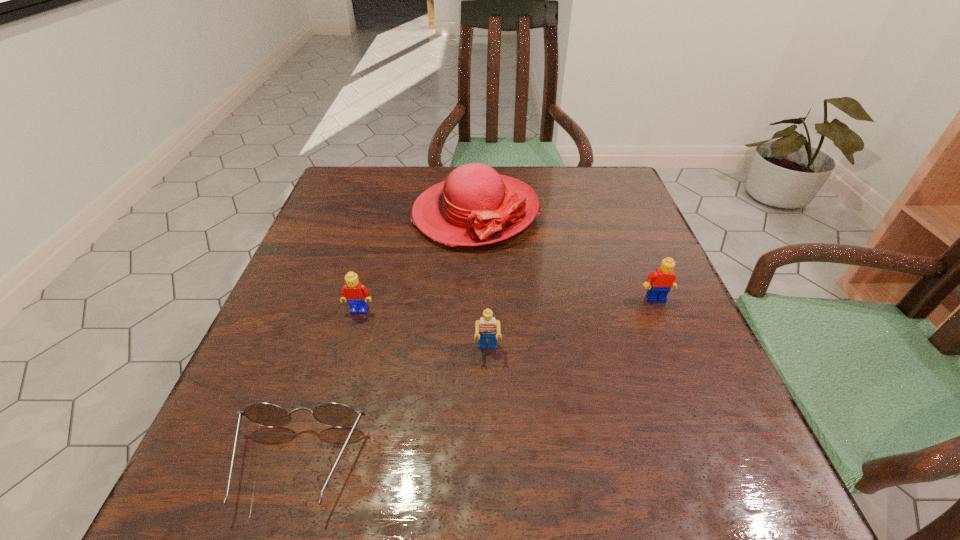
This screenshot has height=540, width=960. What are the coordinates of `free space located at the front of the tallest object with a bow` in the screenshot? It's located at (473, 349).

Where is `vacant space located 0.280m on the face of the rightmost Lego`? vacant space located 0.280m on the face of the rightmost Lego is located at coordinates (716, 443).

What are the coordinates of `free spot located on the front-facing side of the leftmost Lego` in the screenshot? It's located at coord(308,495).

Where is `vacant space situated on the face of the second Lego from left to right`? This screenshot has width=960, height=540. vacant space situated on the face of the second Lego from left to right is located at coordinates (489, 427).

Where is `object located in the far edge section of the desktop`? object located in the far edge section of the desktop is located at coordinates (474, 206).

Find the location of a particular element. The width and height of the screenshot is (960, 540). object present at the near edge is located at coordinates (333, 414).

Identify the location of Lego situated at the left edge. (356, 294).

Where is `spectacles that is at the left edge`? spectacles that is at the left edge is located at coordinates (333, 414).

What are the coordinates of `object that is at the right edge` in the screenshot? It's located at (663, 279).

Identify the location of object present at the near left corner. (333, 414).